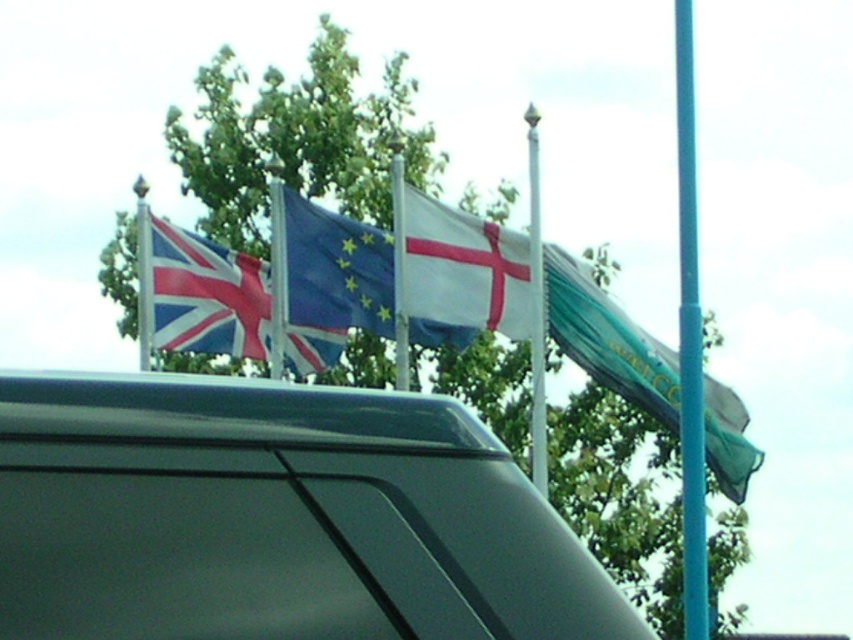
Does white matte flag at center appear on the left side of blue metallic pole at right?

Indeed, white matte flag at center is positioned on the left side of blue metallic pole at right.

Does white matte flag at center appear under blue metallic pole at right?

No, white matte flag at center is not below blue metallic pole at right.

You are a GUI agent. You are given a task and a screenshot of the screen. Output one action in this format:
    pyautogui.click(x=<x>, y=<y>)
    Task: Click on the white matte flag at center
    The image size is (853, 640).
    Given the screenshot: What is the action you would take?
    pyautogui.click(x=463, y=269)

Does metallic gray car at center have a larger size compared to white matte flag at center?

Incorrect, metallic gray car at center is not larger than white matte flag at center.

The height and width of the screenshot is (640, 853). Find the location of `metallic gray car at center`. metallic gray car at center is located at coordinates (276, 518).

Identify the location of metallic gray car at center. (276, 518).

Does white matte flag at center appear over blue fabric flag at center?

Actually, white matte flag at center is below blue fabric flag at center.

Describe the element at coordinates (463, 269) in the screenshot. This screenshot has width=853, height=640. I see `white matte flag at center` at that location.

This screenshot has width=853, height=640. Find the location of `white matte flag at center`. white matte flag at center is located at coordinates (463, 269).